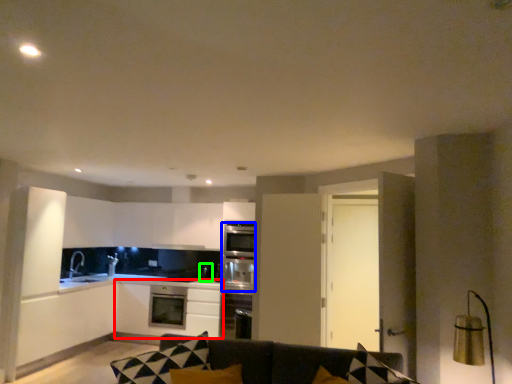
Question: Which object is the closest to the cabinetry (highlighted by a red box)? Choose among these: oven (highlighted by a blue box) or appliance (highlighted by a green box).

Choices:
 (A) oven
 (B) appliance

Answer: (A)